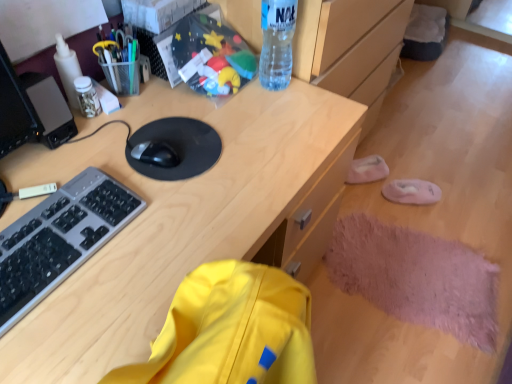
Image resolution: width=512 pixels, height=384 pixels. Find the location of `vacant space in gray plastic keyboard at left (from a real-world perspective)`. vacant space in gray plastic keyboard at left (from a real-world perspective) is located at coordinates (55, 244).